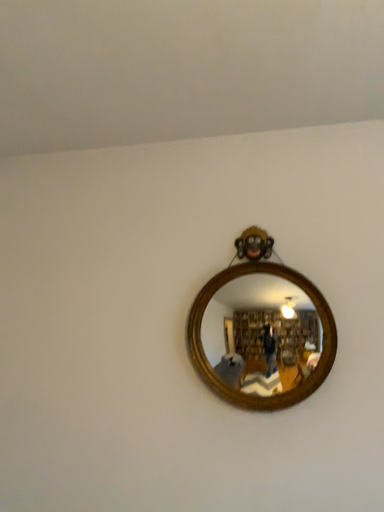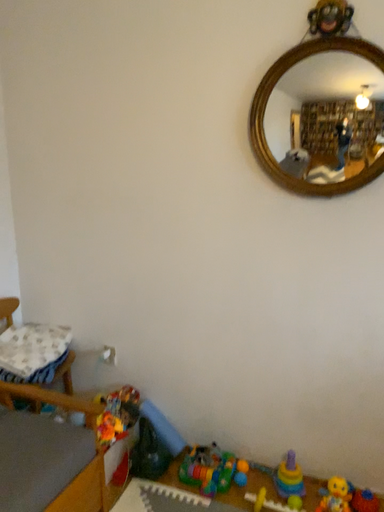
Question: Which way did the camera rotate in the video?

Choices:
 (A) rotated right
 (B) rotated left

Answer: (B)